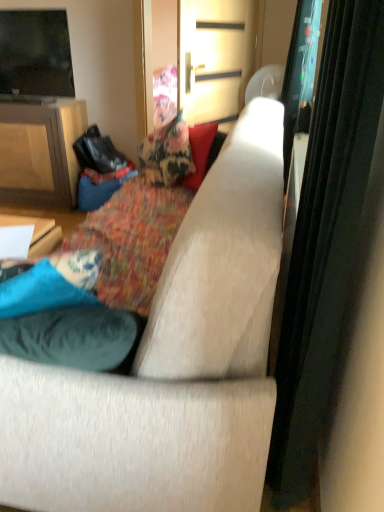
Locate an element on the screen. Image resolution: width=384 pixels, height=512 pixels. metallic gold door at upper center, the first screen door when ordered from left to right is located at coordinates (214, 58).

The width and height of the screenshot is (384, 512). What do you see at coordinates (300, 75) in the screenshot? I see `transparent glass screen door at upper right, acting as the 1th screen door starting from the right` at bounding box center [300, 75].

Describe the element at coordinates (35, 53) in the screenshot. I see `flat screen tv at upper left` at that location.

The image size is (384, 512). What are the coordinates of `metallic gold door at upper center, arranged as the second screen door when viewed from the right` in the screenshot? It's located at (214, 58).

Between transparent glass screen door at upper right, the second screen door viewed from the left, and metallic gold door at upper center, arranged as the second screen door when viewed from the right, which one has less height?

With less height is transparent glass screen door at upper right, the second screen door viewed from the left.

At what (x,y) coordinates should I click in order to perform the action: click on screen door below the metallic gold door at upper center, the first screen door when ordered from left to right (from the image's perspective). Please return your answer as a coordinate pair (x, y). Looking at the image, I should click on (300, 75).

From the image's perspective, is transparent glass screen door at upper right, acting as the 1th screen door starting from the right, below metallic gold door at upper center, arranged as the second screen door when viewed from the right?

Indeed, from the image's perspective, transparent glass screen door at upper right, acting as the 1th screen door starting from the right, is shown beneath metallic gold door at upper center, arranged as the second screen door when viewed from the right.

Is transparent glass screen door at upper right, the second screen door viewed from the left, positioned in front of metallic gold door at upper center, the first screen door when ordered from left to right?

Yes.

Is point (236, 89) in front of point (221, 230)?

No, (236, 89) is further to viewer.

Looking at this image, who is shorter, metallic gold door at upper center, the first screen door when ordered from left to right, or suede-like beige couch at center?

metallic gold door at upper center, the first screen door when ordered from left to right, is shorter.

Is metallic gold door at upper center, arranged as the second screen door when viewed from the right, placed right next to suede-like beige couch at center?

No.

Looking at this image, is suede-like beige couch at center aimed at metallic gold door at upper center, arranged as the second screen door when viewed from the right?

No, suede-like beige couch at center is not oriented towards metallic gold door at upper center, arranged as the second screen door when viewed from the right.

Which is behind, suede-like beige couch at center or metallic gold door at upper center, the first screen door when ordered from left to right?

metallic gold door at upper center, the first screen door when ordered from left to right, is more distant.

From the image's perspective, does suede-like beige couch at center appear lower than metallic gold door at upper center, the first screen door when ordered from left to right?

Yes, from the image's perspective, suede-like beige couch at center is below metallic gold door at upper center, the first screen door when ordered from left to right.

I want to click on studio couch that is on the left side of metallic gold door at upper center, the first screen door when ordered from left to right, so click(x=170, y=365).

From a real-world perspective, which is physically above, suede-like beige couch at center or flat screen tv at upper left?

flat screen tv at upper left.

Who is shorter, suede-like beige couch at center or flat screen tv at upper left?

With less height is flat screen tv at upper left.

Consider the image. Is suede-like beige couch at center oriented towards flat screen tv at upper left?

Yes, suede-like beige couch at center faces towards flat screen tv at upper left.

Based on the photo, is suede-like beige couch at center not close to flat screen tv at upper left?

Absolutely, suede-like beige couch at center is distant from flat screen tv at upper left.

From the image's perspective, is matte wood cabinet at left on metallic gold door at upper center, arranged as the second screen door when viewed from the right?

No, from the image's perspective, matte wood cabinet at left is not on top of metallic gold door at upper center, arranged as the second screen door when viewed from the right.

Which object is closer to the camera, matte wood cabinet at left or metallic gold door at upper center, arranged as the second screen door when viewed from the right?

metallic gold door at upper center, arranged as the second screen door when viewed from the right, is closer to the camera.

Considering the sizes of objects matte wood cabinet at left and metallic gold door at upper center, the first screen door when ordered from left to right, in the image provided, who is taller, matte wood cabinet at left or metallic gold door at upper center, the first screen door when ordered from left to right,?

With more height is matte wood cabinet at left.

Is matte wood cabinet at left wider or thinner than metallic gold door at upper center, arranged as the second screen door when viewed from the right?

matte wood cabinet at left is wider than metallic gold door at upper center, arranged as the second screen door when viewed from the right.

From the image's perspective, which object appears higher, flat screen tv at upper left or suede-like beige couch at center?

flat screen tv at upper left appears higher in the image.

Considering the positions of points (47, 31) and (140, 353), is point (47, 31) farther from camera compared to point (140, 353)?

Yes, point (47, 31) is behind point (140, 353).

From the picture: Between flat screen tv at upper left and suede-like beige couch at center, which one appears on the left side from the viewer's perspective?

From the viewer's perspective, flat screen tv at upper left appears more on the left side.

Considering the sizes of objects flat screen tv at upper left and suede-like beige couch at center in the image provided, who is smaller, flat screen tv at upper left or suede-like beige couch at center?

With smaller size is flat screen tv at upper left.

Does suede-like beige couch at center have a greater width compared to transparent glass screen door at upper right, the second screen door viewed from the left?

Correct, the width of suede-like beige couch at center exceeds that of transparent glass screen door at upper right, the second screen door viewed from the left.

In terms of size, does suede-like beige couch at center appear bigger or smaller than transparent glass screen door at upper right, acting as the 1th screen door starting from the right?

Clearly, suede-like beige couch at center is larger in size than transparent glass screen door at upper right, acting as the 1th screen door starting from the right.

From the picture: Is suede-like beige couch at center surrounding transparent glass screen door at upper right, acting as the 1th screen door starting from the right?

No, transparent glass screen door at upper right, acting as the 1th screen door starting from the right, is located outside of suede-like beige couch at center.

From a real-world perspective, is suede-like beige couch at center positioned above or below transparent glass screen door at upper right, acting as the 1th screen door starting from the right?

suede-like beige couch at center is below transparent glass screen door at upper right, acting as the 1th screen door starting from the right.

Identify the location of screen door below the metallic gold door at upper center, the first screen door when ordered from left to right (from the image's perspective). This screenshot has height=512, width=384. (300, 75).

The height and width of the screenshot is (512, 384). In order to click on the 2nd screen door above the suede-like beige couch at center (from the image's perspective) in this screenshot , I will do `click(214, 58)`.

Estimate the real-world distances between objects in this image. Which object is further from transparent glass screen door at upper right, the second screen door viewed from the left, suede-like beige couch at center or flat screen tv at upper left?

The object further to transparent glass screen door at upper right, the second screen door viewed from the left, is flat screen tv at upper left.

From the image, which object appears to be farther from floral fabric cushion at center, matte wood cabinet at left or metallic gold door at upper center, arranged as the second screen door when viewed from the right?

matte wood cabinet at left.

Which object lies nearer to the anchor point matte wood cabinet at left, transparent glass screen door at upper right, the second screen door viewed from the left, or metallic gold door at upper center, the first screen door when ordered from left to right?

metallic gold door at upper center, the first screen door when ordered from left to right, is positioned closer to the anchor matte wood cabinet at left.

When comparing their distances from suede-like beige couch at center, does flat screen tv at upper left or transparent glass screen door at upper right, acting as the 1th screen door starting from the right, seem further?

flat screen tv at upper left.

Based on their spatial positions, is suede-like beige couch at center or metallic gold door at upper center, arranged as the second screen door when viewed from the right, further from flat screen tv at upper left?

suede-like beige couch at center is further to flat screen tv at upper left.

Estimate the real-world distances between objects in this image. Which object is further from flat screen tv at upper left, suede-like beige couch at center or floral fabric cushion at center?

suede-like beige couch at center.

When comparing their distances from transparent glass screen door at upper right, the second screen door viewed from the left, does matte wood cabinet at left or flat screen tv at upper left seem further?

The object further to transparent glass screen door at upper right, the second screen door viewed from the left, is matte wood cabinet at left.

Considering their positions, is floral fabric cushion at center positioned closer to flat screen tv at upper left than transparent glass screen door at upper right, the second screen door viewed from the left?

The object closer to flat screen tv at upper left is floral fabric cushion at center.

Locate an element on the screen. screen door between metallic gold door at upper center, arranged as the second screen door when viewed from the right, and floral fabric cushion at center vertically is located at coordinates (300, 75).

I want to click on bedding located between matte wood cabinet at left and transparent glass screen door at upper right, acting as the 1th screen door starting from the right, in the left-right direction, so click(x=133, y=239).

Where is `screen door between flat screen tv at upper left and transparent glass screen door at upper right, the second screen door viewed from the left`? The width and height of the screenshot is (384, 512). screen door between flat screen tv at upper left and transparent glass screen door at upper right, the second screen door viewed from the left is located at coordinates (214, 58).

Identify the location of screen door between suede-like beige couch at center and metallic gold door at upper center, the first screen door when ordered from left to right, in the front-back direction. The height and width of the screenshot is (512, 384). [x=300, y=75].